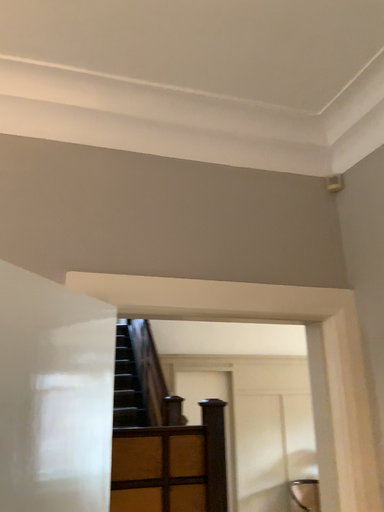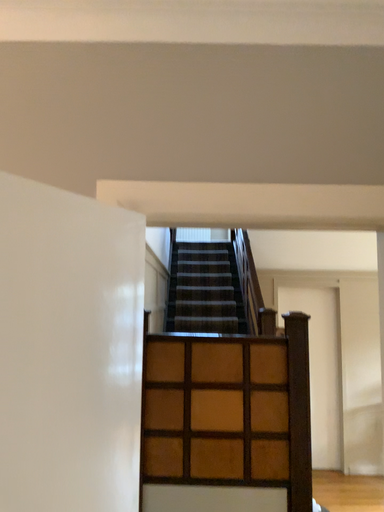
Question: How did the camera likely rotate when shooting the video?

Choices:
 (A) rotated upward
 (B) rotated downward

Answer: (B)